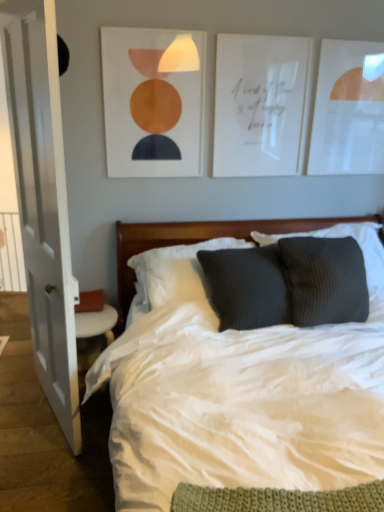
Question: Does white paper picture frame at upper center, the 2th picture frame positioned from the right, come in front of matte orange circle at upper center, arranged as the first picture frame when viewed from the left?

Choices:
 (A) yes
 (B) no

Answer: (B)

Question: Considering the relative sizes of white paper picture frame at upper center, arranged as the second picture frame when viewed from the left, and matte orange circle at upper center, which is the third picture frame in right-to-left order, in the image provided, is white paper picture frame at upper center, arranged as the second picture frame when viewed from the left, taller than matte orange circle at upper center, which is the third picture frame in right-to-left order,?

Choices:
 (A) yes
 (B) no

Answer: (B)

Question: Is white paper picture frame at upper center, arranged as the second picture frame when viewed from the left, aimed at matte orange circle at upper center, which is the third picture frame in right-to-left order?

Choices:
 (A) no
 (B) yes

Answer: (A)

Question: Can matte orange circle at upper center, which is the third picture frame in right-to-left order, be found inside white paper picture frame at upper center, the 2th picture frame positioned from the right?

Choices:
 (A) yes
 (B) no

Answer: (B)

Question: Would you say white paper picture frame at upper center, arranged as the second picture frame when viewed from the left, is a long distance from matte orange circle at upper center, which is the third picture frame in right-to-left order?

Choices:
 (A) no
 (B) yes

Answer: (A)

Question: From the image's perspective, is white paper picture frame at upper right, the first picture frame positioned from the right, positioned above or below wooden headboard at center?

Choices:
 (A) below
 (B) above

Answer: (B)

Question: Does point (372, 55) appear closer or farther from the camera than point (172, 226)?

Choices:
 (A) farther
 (B) closer

Answer: (B)

Question: Is white paper picture frame at upper right, the first picture frame positioned from the right, wider or thinner than wooden headboard at center?

Choices:
 (A) thin
 (B) wide

Answer: (A)

Question: Choose the correct answer: Is white paper picture frame at upper right, the first picture frame positioned from the right, inside wooden headboard at center or outside it?

Choices:
 (A) outside
 (B) inside

Answer: (A)

Question: Would you say wooden headboard at center is to the left or to the right of white paper picture frame at upper right, the first picture frame positioned from the right, in the picture?

Choices:
 (A) left
 (B) right

Answer: (A)

Question: Relative to white paper picture frame at upper right, the 3th picture frame when ordered from left to right, is wooden headboard at center in front or behind?

Choices:
 (A) front
 (B) behind

Answer: (A)

Question: Is wooden headboard at center inside the boundaries of white paper picture frame at upper right, the first picture frame positioned from the right, or outside?

Choices:
 (A) inside
 (B) outside

Answer: (B)

Question: Considering the positions of wooden headboard at center and white paper picture frame at upper right, the 3th picture frame when ordered from left to right, in the image, is wooden headboard at center taller or shorter than white paper picture frame at upper right, the 3th picture frame when ordered from left to right,?

Choices:
 (A) short
 (B) tall

Answer: (A)

Question: Is matte orange circle at upper center, arranged as the first picture frame when viewed from the left, inside or outside of white soft bed at center?

Choices:
 (A) inside
 (B) outside

Answer: (B)

Question: From the image's perspective, is matte orange circle at upper center, arranged as the first picture frame when viewed from the left, above or below white soft bed at center?

Choices:
 (A) below
 (B) above

Answer: (B)